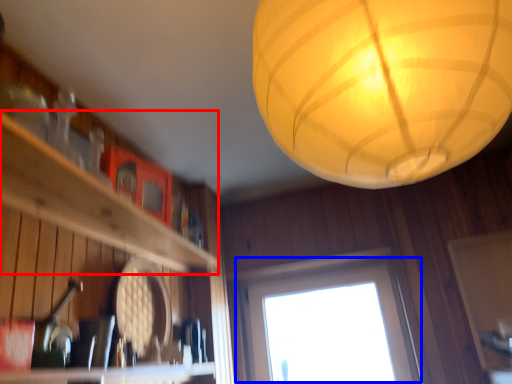
Question: Which object is closer to the camera taking this photo, shelf (highlighted by a red box) or window (highlighted by a blue box)?

Choices:
 (A) shelf
 (B) window

Answer: (A)